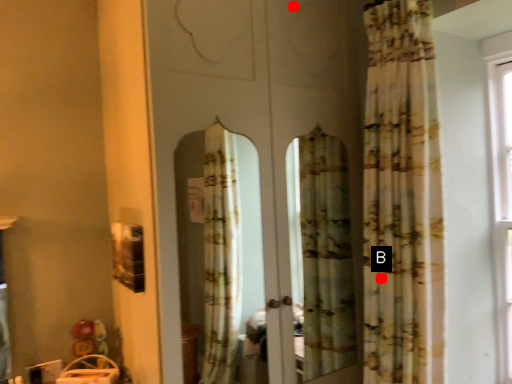
Question: Two points are circled on the image, labeled by A and B beside each circle. Which point is further to the camera?

Choices:
 (A) A is further
 (B) B is further

Answer: (A)